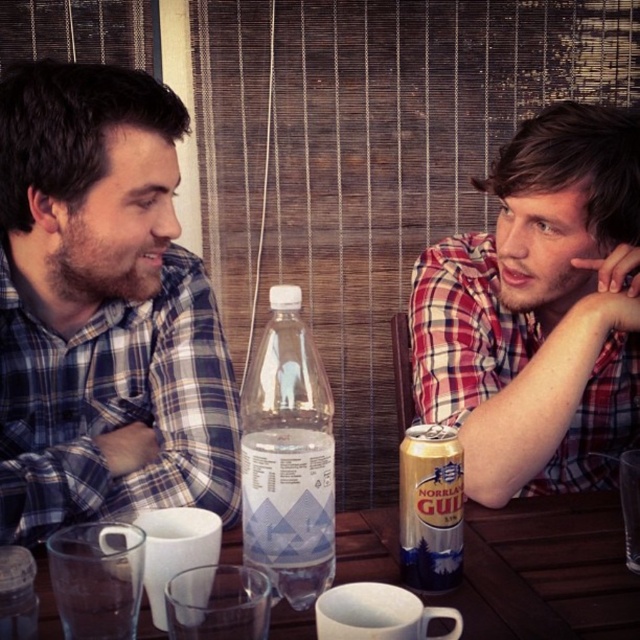
You are a photographer trying to capture a candid shot of both the red plaid shirt at right and the transparent plastic table at center. Based on their heights, which object should you focus on first to ensure both are in frame?

The red plaid shirt at right is taller than the transparent plastic table at center, so you should focus on the red plaid shirt at right first to ensure both are in frame.

You are at a picnic table in the park and see the transparent plastic table at center and the gold aluminum can at center. Which object is closer to your left side?

The transparent plastic table at center is closer to your left side since it is positioned to the left of the gold aluminum can at center.

You are standing in front of the wooden table where the two people are sitting. You want to place a small vase exactly at the point labeled as point [552,520]. If your hand is currently 1 meter away from the table, can you reach the point without moving your feet?

The point [552,520] is 83.24 centimeters away from the viewer. Since your hand is already 1 meter away from the table, which is slightly farther than the required distance, you can comfortably reach the point without needing to move your feet.